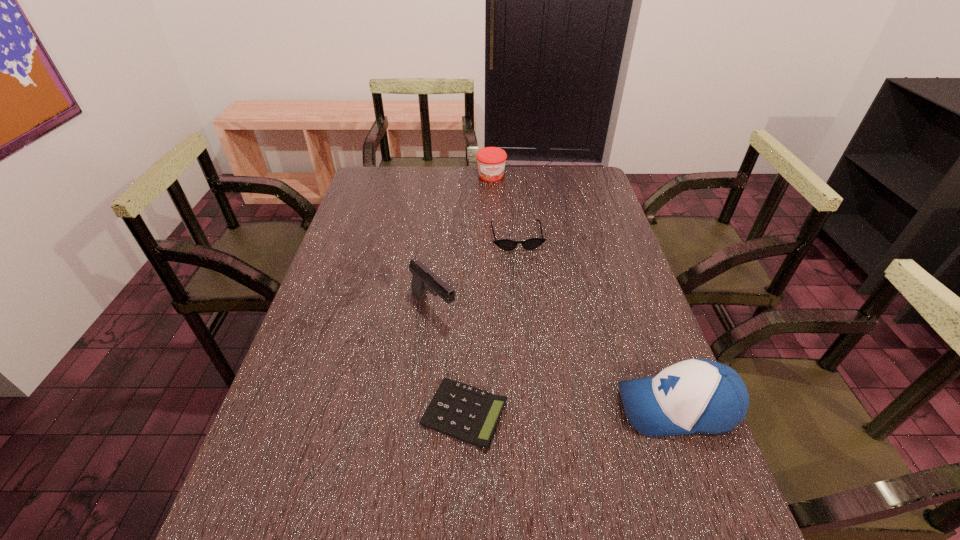
At what (x,y) coordinates should I click in order to perform the action: click on the shortest object. Please return your answer as a coordinate pair (x, y). Looking at the image, I should click on (469, 414).

I want to click on baseball cap, so click(x=696, y=396).

Identify the location of the fourth nearest object. Image resolution: width=960 pixels, height=540 pixels. pos(505,244).

Where is `sunglasses`? sunglasses is located at coordinates (505, 244).

Find the location of a particular element. the third farthest object is located at coordinates (423, 279).

At what (x,y) coordinates should I click in order to perform the action: click on the farthest object. Please return your answer as a coordinate pair (x, y). The width and height of the screenshot is (960, 540). Looking at the image, I should click on (491, 161).

In order to click on jam in this screenshot , I will do `click(491, 161)`.

At what (x,y) coordinates should I click in order to perform the action: click on vacant space situated 0.070m on the left of the shortest object. Please return your answer as a coordinate pair (x, y). This screenshot has width=960, height=540. Looking at the image, I should click on (390, 413).

I want to click on vacant space located 0.300m on the front-facing side of the rightmost object, so click(x=483, y=408).

Locate an element on the screen. The image size is (960, 540). free space located on the front-facing side of the rightmost object is located at coordinates pyautogui.click(x=545, y=408).